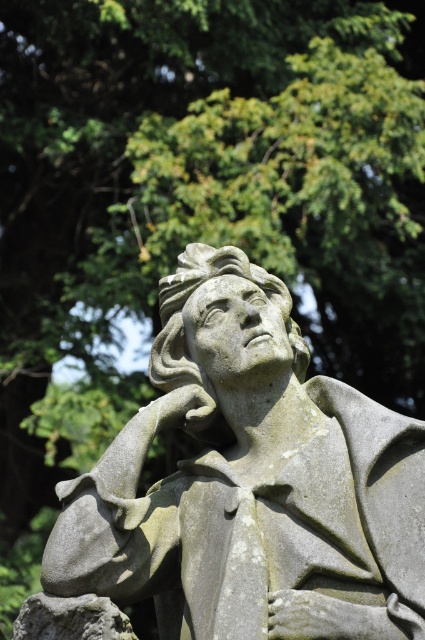
Does point (153, 500) come closer to viewer compared to point (85, 621)?

That is False.

Which is in front, point (274, 323) or point (90, 625)?

Point (90, 625)

Who is more distant from viewer, (255, 572) or (59, 598)?

Point (59, 598)

You are a GUI agent. You are given a task and a screenshot of the screen. Output one action in this format:
    pyautogui.click(x=<x>, y=<y>)
    Task: Click on the gray stone statue at center
    
    Given the screenshot: What is the action you would take?
    pyautogui.click(x=251, y=481)